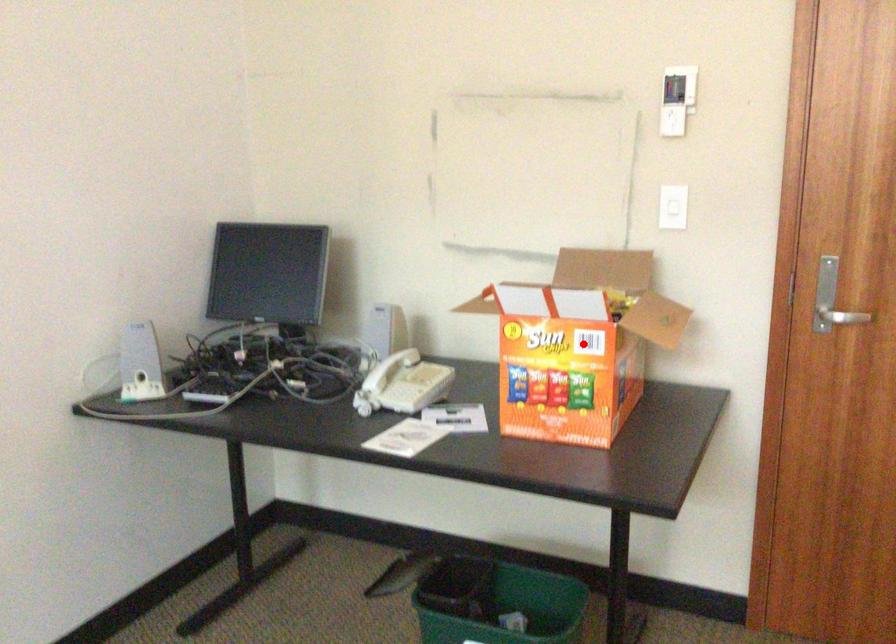
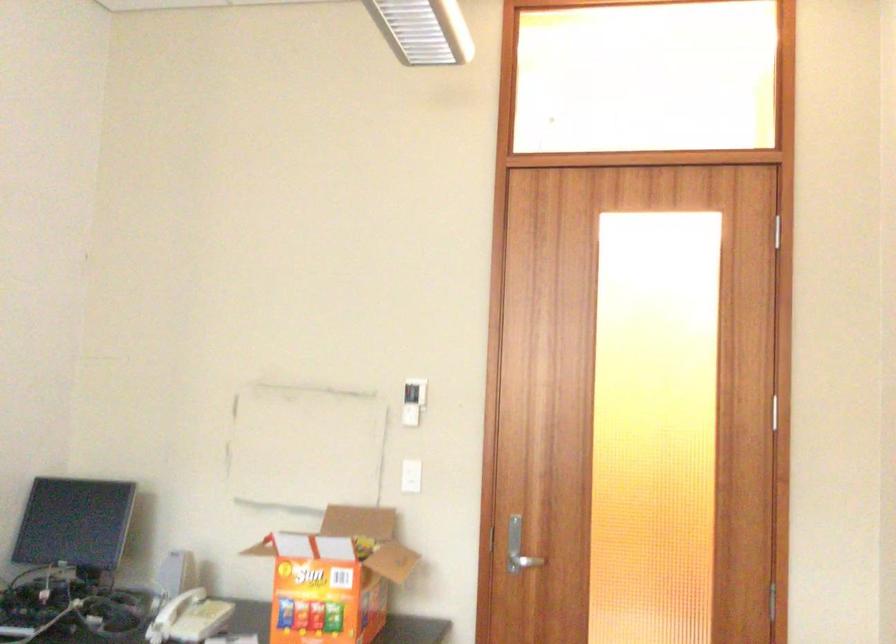
Where in the second image is the point corresponding to the highlighted location from the first image?

(334, 576)